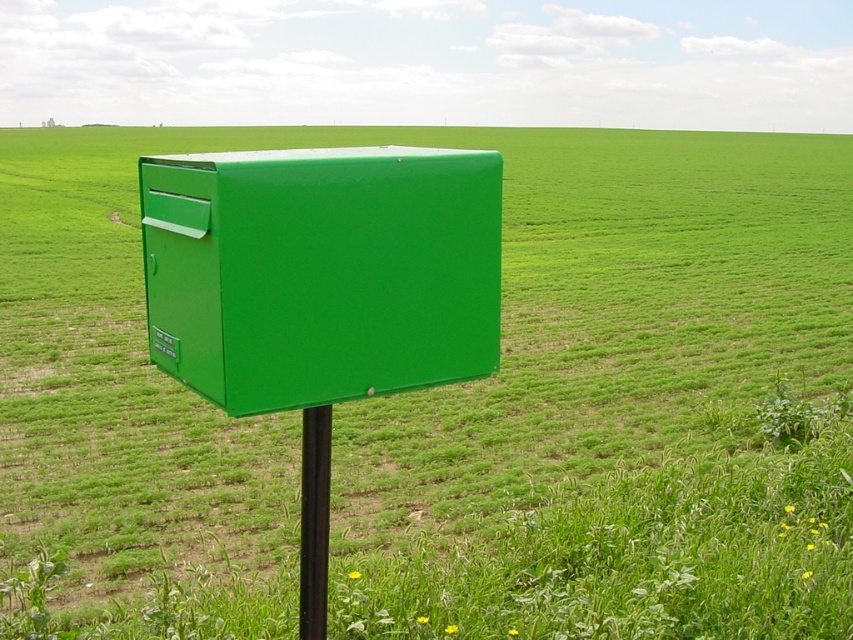
Describe the element at coordinates (321, 272) in the screenshot. I see `green glossy mailbox at center` at that location.

Between green glossy mailbox at center and black metal pole at center, which one is positioned higher?

green glossy mailbox at center

Does point (489, 268) come farther from viewer compared to point (306, 632)?

No, it is in front of (306, 632).

The width and height of the screenshot is (853, 640). What are the coordinates of `green glossy mailbox at center` in the screenshot? It's located at (321, 272).